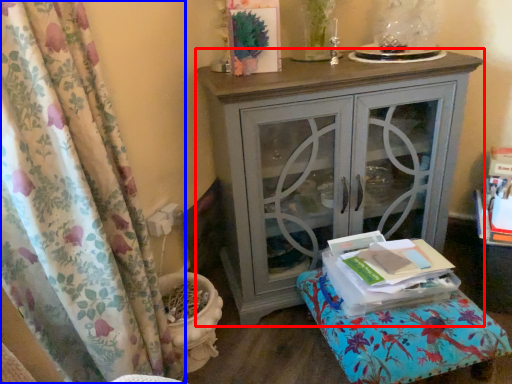
Question: Which of the following is the closest to the observer, nightstand (highlighted by a red box) or curtain (highlighted by a blue box)?

Choices:
 (A) nightstand
 (B) curtain

Answer: (B)